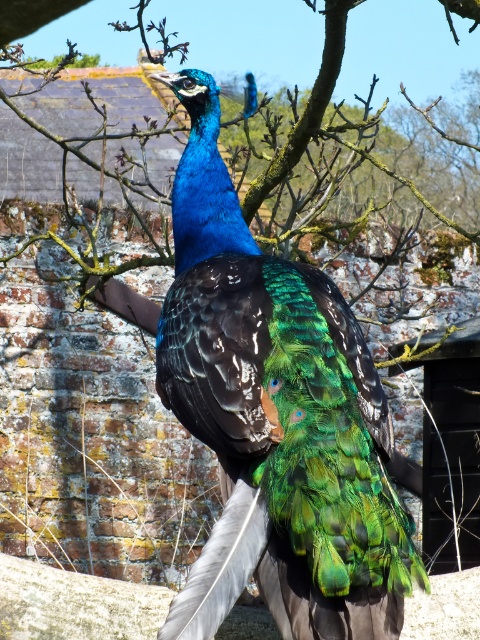
Who is higher up, shiny blue peacock at center or green leafy tree at center?

Positioned higher is green leafy tree at center.

Between point (297, 339) and point (191, 10), which one is positioned behind?

Positioned behind is point (191, 10).

Find the location of a particular element. The image size is (480, 640). shiny blue peacock at center is located at coordinates (282, 403).